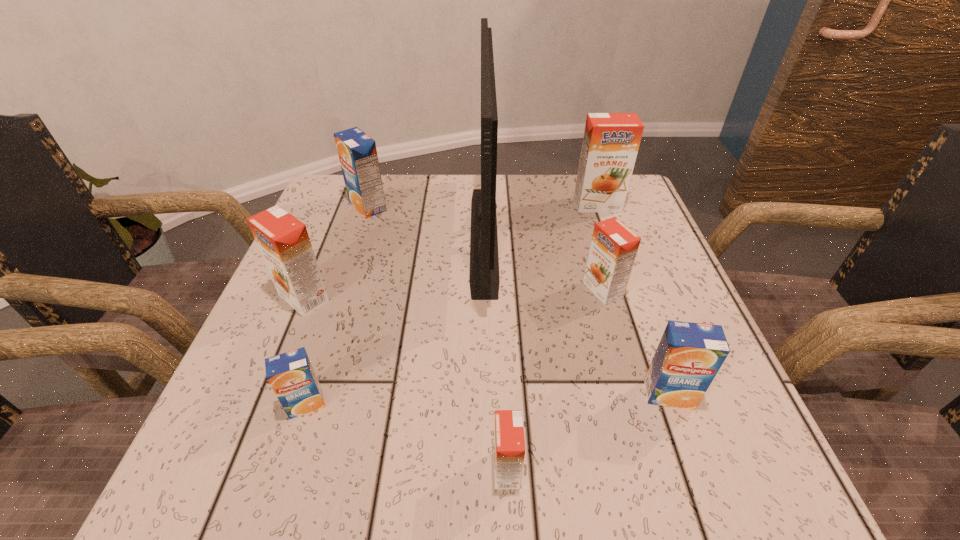
Find the location of a particular element. This screenshot has height=540, width=960. vacant area in the image that satisfies the following two spatial constraints: 1. on the front-facing side of the second smallest orange orange juice; 2. on the right side of the monitor is located at coordinates (485, 289).

I want to click on vacant space that satisfies the following two spatial constraints: 1. on the front-facing side of the tallest object; 2. on the right side of the nearest orange orange juice, so click(487, 469).

Where is `free location that satisfies the following two spatial constraints: 1. on the back side of the third biggest orange orange juice; 2. on the front-facing side of the monitor`? The width and height of the screenshot is (960, 540). free location that satisfies the following two spatial constraints: 1. on the back side of the third biggest orange orange juice; 2. on the front-facing side of the monitor is located at coordinates (588, 237).